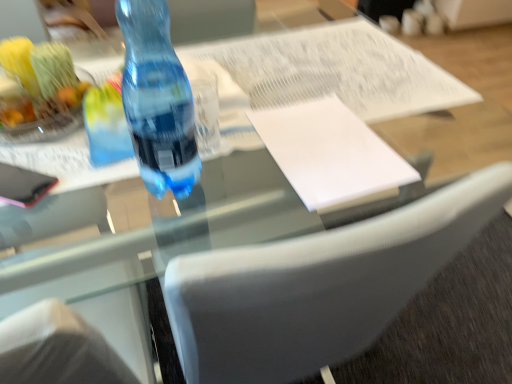
This screenshot has height=384, width=512. I want to click on free spot behind transparent plastic bottle at center, so click(x=234, y=98).